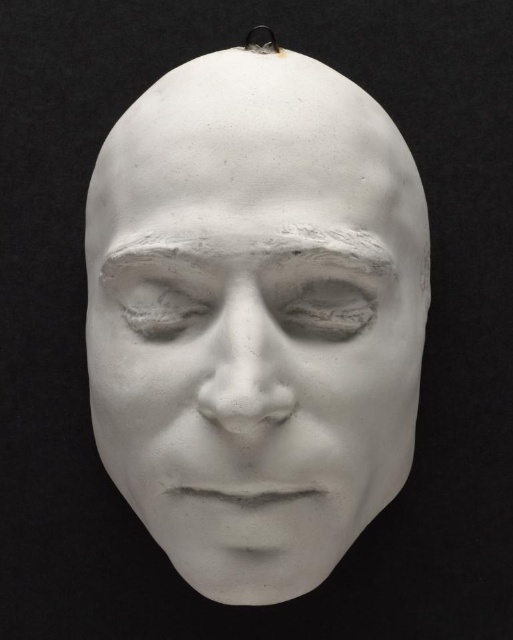
Question: Which object is closer to the camera taking this photo?

Choices:
 (A) matte white eye at center
 (B) white matte plaster forehead at upper center

Answer: (B)

Question: Where is white matte mask at center located in relation to matte white eye at center in the image?

Choices:
 (A) below
 (B) above

Answer: (A)

Question: Is white matte mask at center closer to the viewer compared to matte white eye at center?

Choices:
 (A) no
 (B) yes

Answer: (B)

Question: Which of the following is the closest to the observer?

Choices:
 (A) (135, 481)
 (B) (290, 284)
 (C) (226, 156)

Answer: (C)

Question: Does white matte mask at center appear under white matte plaster forehead at upper center?

Choices:
 (A) yes
 (B) no

Answer: (A)

Question: Which point is farther from the camera taking this photo?

Choices:
 (A) (334, 81)
 (B) (103, 236)
 (C) (332, 300)

Answer: (B)